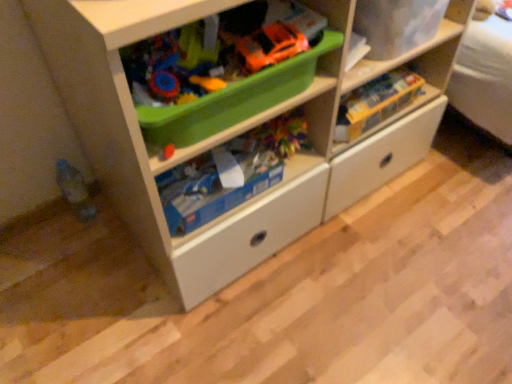
Image resolution: width=512 pixels, height=384 pixels. Find the location of `vacant space to the left of matte plastic toy at lower left, the third toy from the right`. vacant space to the left of matte plastic toy at lower left, the third toy from the right is located at coordinates (42, 228).